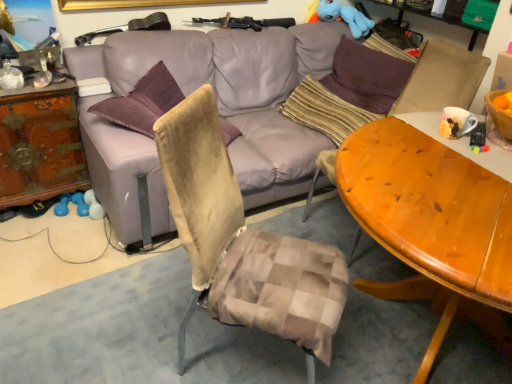
Question: Is wooden carved dresser at left bigger or smaller than striped fabric pillow at center, which is the second pillow from right to left?

Choices:
 (A) small
 (B) big

Answer: (B)

Question: Does point (1, 180) appear closer or farther from the camera than point (301, 89)?

Choices:
 (A) farther
 (B) closer

Answer: (B)

Question: Which object is the closest to the matte ceramic mug at upper right?

Choices:
 (A) purple fabric pillow at upper right, which is the second pillow from left to right
 (B) brown fabric swivel chair at right
 (C) translucent glass bottle at upper left
 (D) purple leather couch at center
 (E) wooden table at center

Answer: (E)

Question: Estimate the real-world distances between objects in this image. Which object is farther from the translucent glass bottle at upper left?

Choices:
 (A) striped fabric pillow at center, arranged as the 1th pillow when viewed from the left
 (B) blue plush toy at upper right
 (C) matte ceramic mug at upper right
 (D) brown fabric swivel chair at right
 (E) purple fabric pillow at upper right, which appears as the first pillow when viewed from the right

Answer: (B)